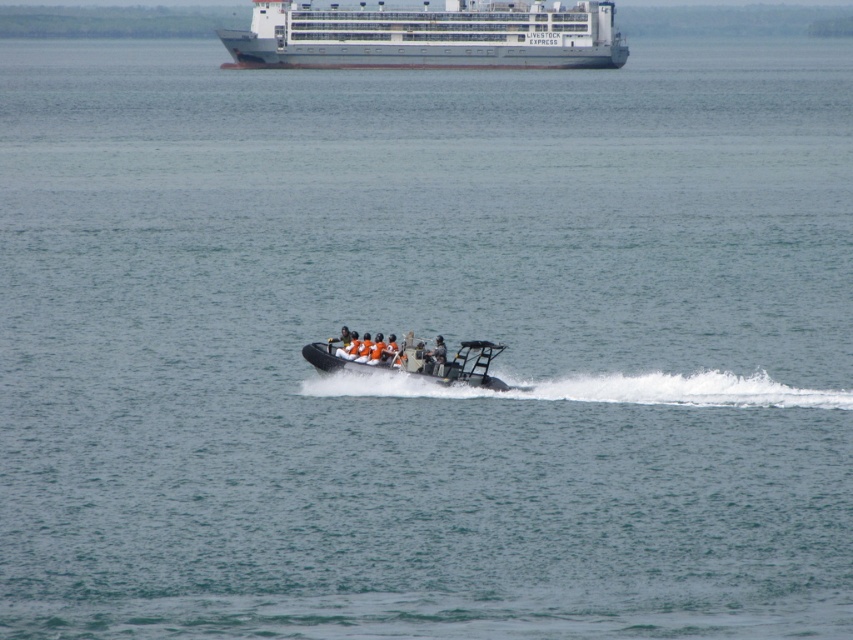
Question: Is white matte cruise ship at upper center to the left of orange life vest at center from the viewer's perspective?

Choices:
 (A) yes
 (B) no

Answer: (A)

Question: Which object appears farthest from the camera in this image?

Choices:
 (A) orange fabric boat at center
 (B) orange life vest at center
 (C) white matte cruise ship at upper center

Answer: (C)

Question: Which point appears closest to the camera in this image?

Choices:
 (A) (381, 346)
 (B) (352, 356)

Answer: (B)

Question: Can you confirm if orange fabric boat at center is positioned below orange life vest at center?

Choices:
 (A) yes
 (B) no

Answer: (A)

Question: Considering the relative positions of orange fabric boat at center and orange life vest at center in the image provided, where is orange fabric boat at center located with respect to orange life vest at center?

Choices:
 (A) below
 (B) above

Answer: (A)

Question: Which of the following is the farthest from the observer?

Choices:
 (A) (592, 17)
 (B) (445, 381)
 (C) (351, 358)

Answer: (A)